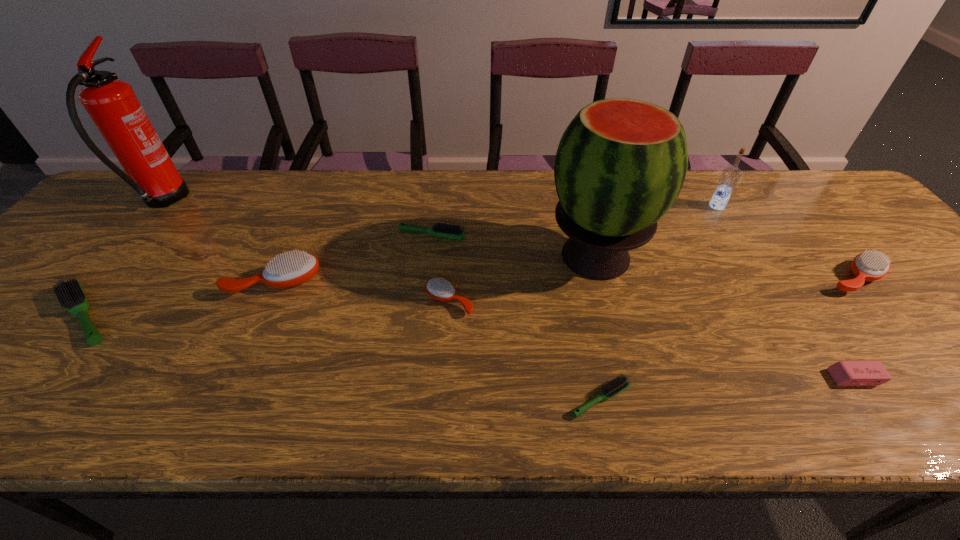
At what (x,y) coordinates should I click in order to perform the action: click on free point between the green watermelon and the blue vodka. Please return your answer as a coordinate pair (x, y). The image size is (960, 540). Looking at the image, I should click on (657, 232).

The image size is (960, 540). In order to click on free space that is in between the nearest light hairbrush and the red fire extinguisher in this screenshot , I will do `click(381, 300)`.

You are a GUI agent. You are given a task and a screenshot of the screen. Output one action in this format:
    pyautogui.click(x=<x>, y=<y>)
    Task: Click on the vacant area between the green watermelon and the eighth object from right to left
    The height and width of the screenshot is (540, 960).
    Given the screenshot: What is the action you would take?
    pyautogui.click(x=435, y=269)

Identify the location of vacant area that lies between the biggest light hairbrush and the nearest light hairbrush. Image resolution: width=960 pixels, height=540 pixels. (343, 357).

Where is `unoccupied area between the seventh shortest object and the fire extinguisher`? The height and width of the screenshot is (540, 960). unoccupied area between the seventh shortest object and the fire extinguisher is located at coordinates (218, 242).

The width and height of the screenshot is (960, 540). What are the coordinates of `free space between the farthest light hairbrush and the second tallest hairbrush` in the screenshot? It's located at (643, 256).

I want to click on free space that is in between the second orange hairbrush from right to left and the pink eraser, so click(x=652, y=340).

At what (x,y) coordinates should I click in order to perform the action: click on the fifth closest object to the farthest light hairbrush. Please return your answer as a coordinate pair (x, y). This screenshot has height=540, width=960. Looking at the image, I should click on (70, 294).

At what (x,y) coordinates should I click in order to perform the action: click on object that stands as the third closest to the blue vodka. Please return your answer as a coordinate pair (x, y). Image resolution: width=960 pixels, height=540 pixels. Looking at the image, I should click on (844, 373).

Select which hairbrush appears as the fifth closest to the smallest light hairbrush. Please provide its 2D coordinates. Your answer should be formatted as a tuple, i.e. [(x, y)], where the tuple contains the x and y coordinates of a point satisfying the conditions above.

[(70, 294)]